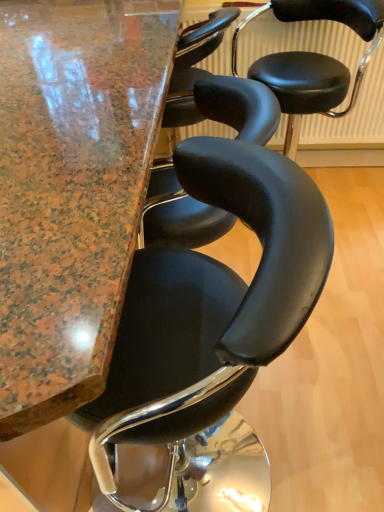
Question: Is the surface of black leather stool at center, marked as the 2th chair in a front-to-back arrangement, in direct contact with marble table at center?

Choices:
 (A) yes
 (B) no

Answer: (B)

Question: From a real-world perspective, is black leather stool at center, marked as the 2th chair in a front-to-back arrangement, over marble table at center?

Choices:
 (A) no
 (B) yes

Answer: (B)

Question: Can you confirm if black leather stool at center, marked as the 2th chair in a front-to-back arrangement, is shorter than marble table at center?

Choices:
 (A) no
 (B) yes

Answer: (B)

Question: Is black leather stool at center, placed as the first chair when sorted from top to bottom, closer to the viewer compared to marble table at center?

Choices:
 (A) yes
 (B) no

Answer: (B)

Question: Is black leather stool at center, arranged as the first chair when viewed from the back, completely or partially outside of marble table at center?

Choices:
 (A) yes
 (B) no

Answer: (A)

Question: Looking at the image, does black leather chair at center, which is the second chair from top to bottom, seem bigger or smaller compared to black leather stool at center, placed as the first chair when sorted from top to bottom?

Choices:
 (A) small
 (B) big

Answer: (B)

Question: From a real-world perspective, is black leather chair at center, which is the 1th chair in front-to-back order, positioned above or below black leather stool at center, placed as the first chair when sorted from top to bottom?

Choices:
 (A) below
 (B) above

Answer: (A)

Question: In terms of width, does black leather chair at center, positioned as the second chair in back-to-front order, look wider or thinner when compared to black leather stool at center, which is counted as the 2th chair, starting from the bottom?

Choices:
 (A) wide
 (B) thin

Answer: (A)

Question: Does point [x=124, y=434] appear closer or farther from the camera than point [x=291, y=155]?

Choices:
 (A) farther
 (B) closer

Answer: (B)

Question: Does point (332, 62) appear closer or farther from the camera than point (261, 257)?

Choices:
 (A) closer
 (B) farther

Answer: (B)

Question: In terms of height, does black leather stool at center, which is counted as the 2th chair, starting from the bottom, look taller or shorter compared to black leather chair at center, positioned as the second chair in back-to-front order?

Choices:
 (A) tall
 (B) short

Answer: (B)

Question: Considering their positions, is black leather stool at center, arranged as the first chair when viewed from the back, located in front of or behind black leather chair at center, which is the 1th chair in front-to-back order?

Choices:
 (A) behind
 (B) front

Answer: (A)

Question: From the image's perspective, is black leather stool at center, arranged as the first chair when viewed from the back, positioned above or below black leather chair at center, which is the second chair from top to bottom?

Choices:
 (A) above
 (B) below

Answer: (A)

Question: From a real-world perspective, is marble table at center physically located above or below black leather chair at center, which is the second chair from top to bottom?

Choices:
 (A) below
 (B) above

Answer: (A)

Question: From the image's perspective, relative to black leather chair at center, which is the second chair from top to bottom, is marble table at center above or below?

Choices:
 (A) below
 (B) above

Answer: (B)